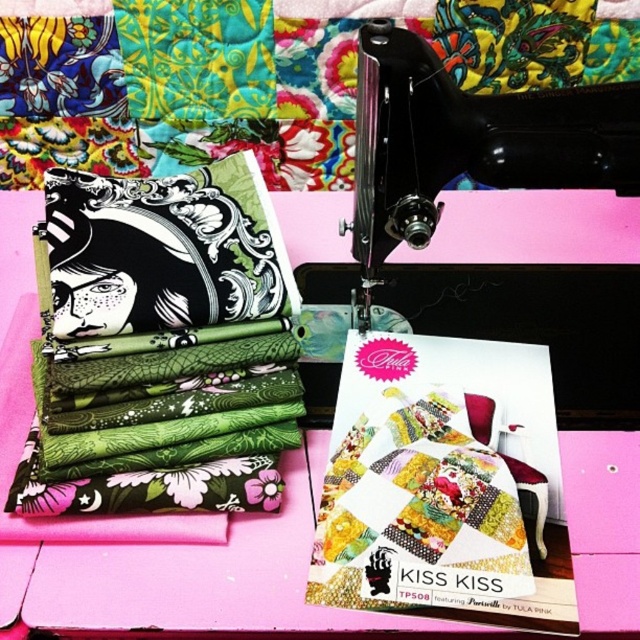
Question: Is pink wood table at center above black plastic sewing machine at center?

Choices:
 (A) yes
 (B) no

Answer: (B)

Question: From the image, what is the correct spatial relationship of pink wood table at center in relation to black plastic sewing machine at center?

Choices:
 (A) right
 (B) left

Answer: (B)

Question: Which of the following is the closest to the observer?

Choices:
 (A) (282, 228)
 (B) (412, 184)

Answer: (B)

Question: Is pink wood table at center to the right of black plastic sewing machine at center from the viewer's perspective?

Choices:
 (A) no
 (B) yes

Answer: (A)